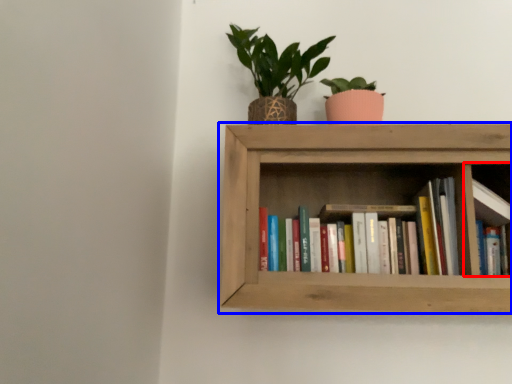
Question: Which of the following is the closest to the observer, cabinet (highlighted by a red box) or shelf (highlighted by a blue box)?

Choices:
 (A) cabinet
 (B) shelf

Answer: (B)